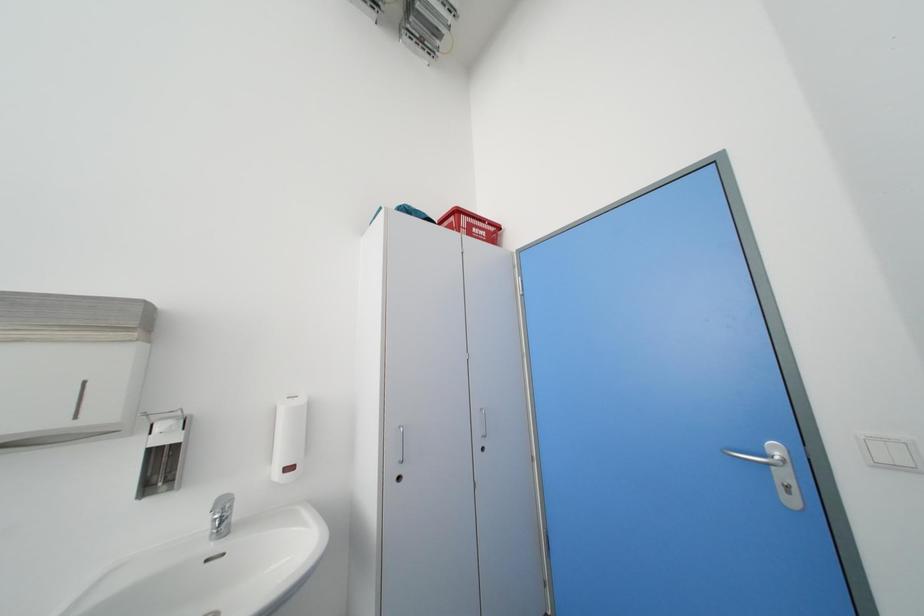
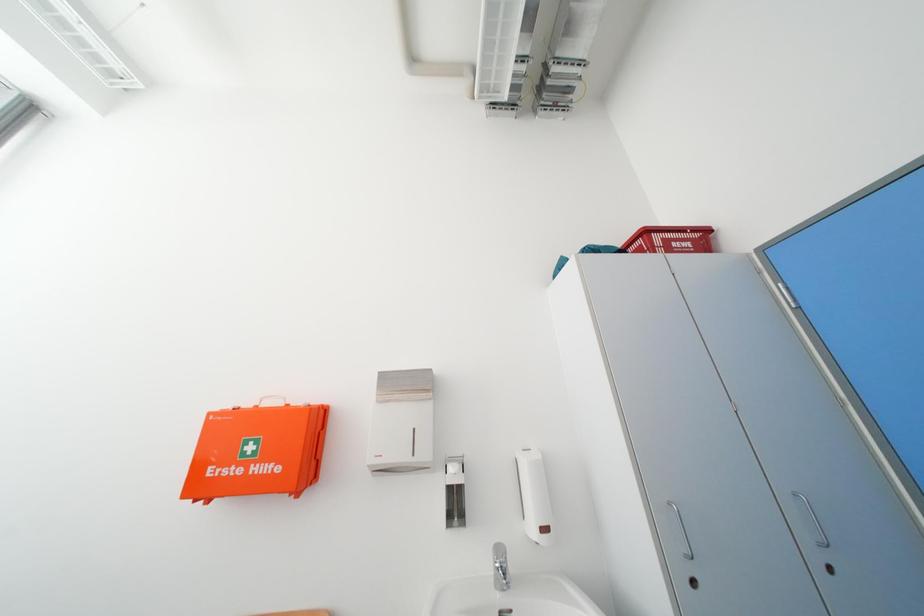
Question: The first image is from the beginning of the video and the second image is from the end. How did the camera likely rotate when shooting the video?

Choices:
 (A) Left
 (B) Right
 (C) Up
 (D) Down

Answer: (A)